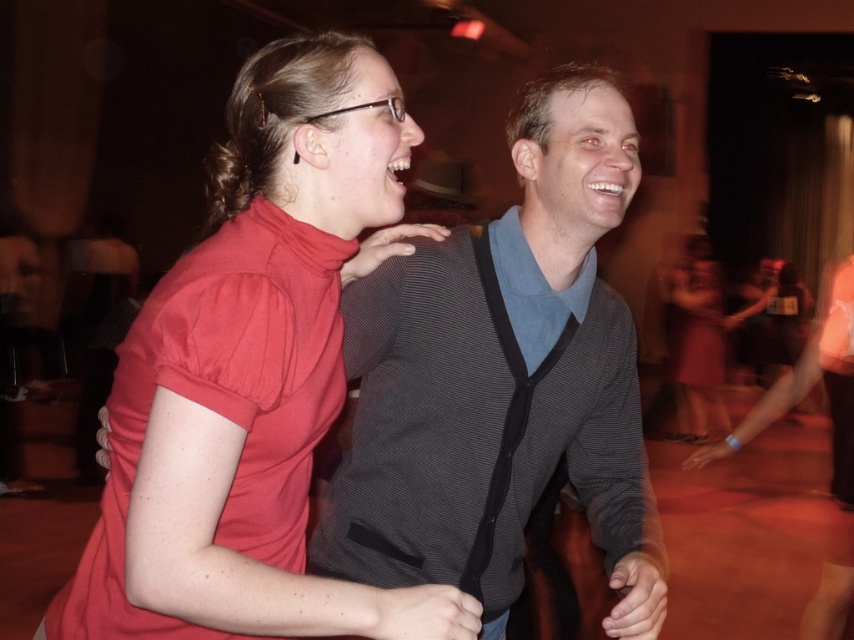
You are organizing a costume party and need to ensure all outfits fit through a narrow doorway. The doorway has a maximum width requirement of 1 meter. You have two outfits to check from the image described. Which outfit, the gray textured sweater at center or the matte red dress at lower right, is narrower and thus more likely to fit through the doorway?

The gray textured sweater at center is narrower than the matte red dress at lower right, so it is more likely to fit through the doorway with a maximum width requirement of 1 meter.

Consider the image. You are a photographer standing at the edge of the dance floor. You need to take a photo of both the gray textured sweater at center and the matte red dress at lower right. Given that your camera has a maximum focus range of 5 meters, will both subjects be in focus?

The distance between the gray textured sweater at center and the matte red dress at lower right is 7.21 meters, which exceeds the camera maximum focus range of 5 meters. Therefore, both subjects cannot be in focus simultaneously.